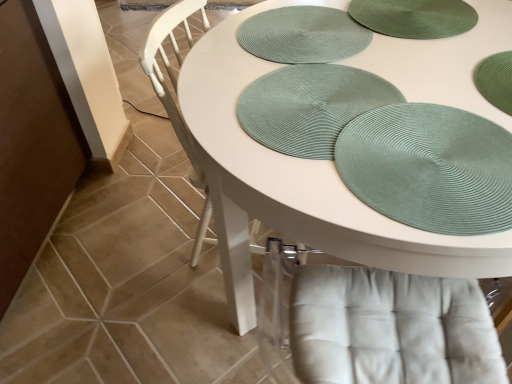
Where is `vacant area that lies to the right of green woven placemat at center, placed as the first platter when sorted from front to back`? The width and height of the screenshot is (512, 384). vacant area that lies to the right of green woven placemat at center, placed as the first platter when sorted from front to back is located at coordinates (446, 95).